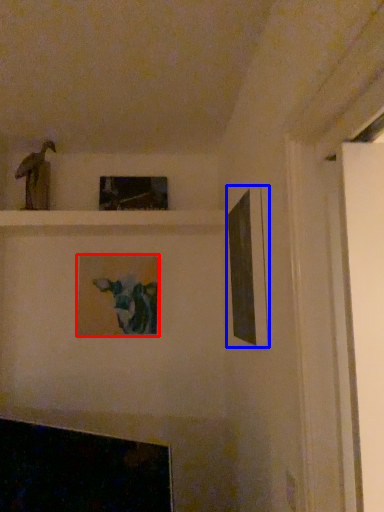
Question: Which point is closer to the camera, picture frame (highlighted by a red box) or picture frame (highlighted by a blue box)?

Choices:
 (A) picture frame
 (B) picture frame

Answer: (B)